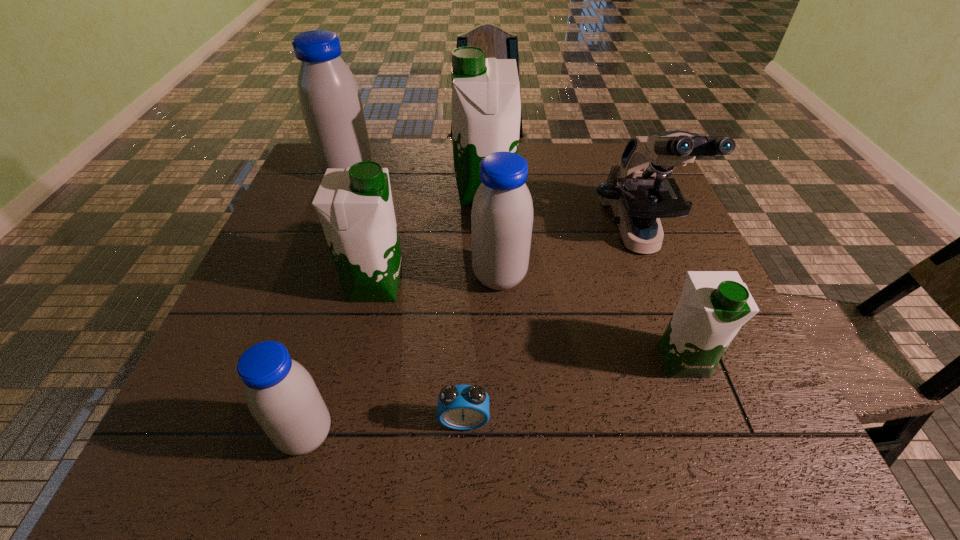
Image resolution: width=960 pixels, height=540 pixels. What are the coordinates of `the second green soya milk from left to right` in the screenshot? It's located at (486, 107).

Where is `the biggest green soya milk`? This screenshot has height=540, width=960. the biggest green soya milk is located at coordinates (486, 107).

Identify the location of the farthest blue soya milk. (329, 97).

This screenshot has width=960, height=540. In order to click on microscope in this screenshot , I will do `click(638, 189)`.

The width and height of the screenshot is (960, 540). Find the location of `the second smallest blue soya milk`. the second smallest blue soya milk is located at coordinates (502, 211).

I want to click on the rightmost blue soya milk, so click(502, 211).

Identify the location of the leftmost green soya milk. The width and height of the screenshot is (960, 540). (354, 204).

Where is `the second smallest green soya milk`? the second smallest green soya milk is located at coordinates (354, 204).

Identify the location of the smallest green soya milk. (714, 305).

Where is `the rightmost green soya milk`? Image resolution: width=960 pixels, height=540 pixels. the rightmost green soya milk is located at coordinates (714, 305).